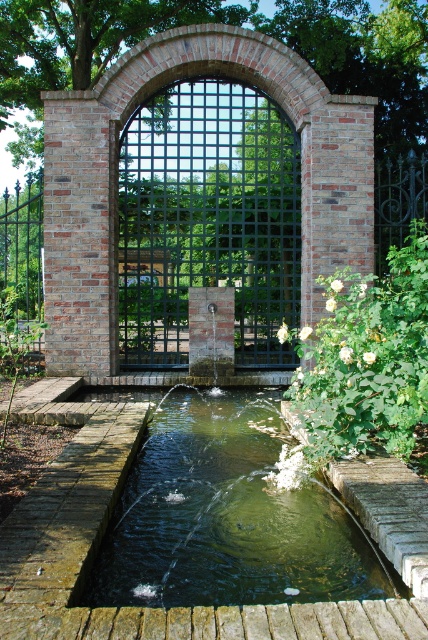
You are standing outside the garden and see the green metal gate at center and white matte flowers at right. Which object is closer to you?

The green metal gate at center is closer to you because the white matte flowers at right is behind it.

You are a gardener who wants to place a decorative statue that is 36 inches wide between the clear glass pond at center and the white matte flowers at right. Can the statue fit in the space between them without overlapping either object?

The clear glass pond at center and white matte flowers at right are 35.67 inches apart. Since the statue is 36 inches wide, it cannot fit in the space between them without overlapping either object.

You are standing in the garden and want to exit through the green metal gate at center. Based on the coordinates provided, is the gate located closer to the top or bottom of the image?

The green metal gate at center is located at coordinates point (208, 220), which places it closer to the bottom of the image since the y coordinate is less than 0.5.